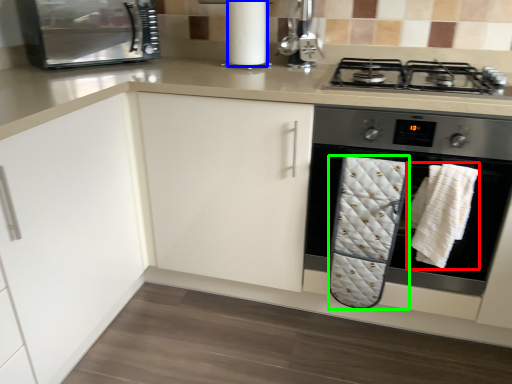
Question: Based on their relative distances, which object is farther from bath towel (highlighted by a red box)? Choose from paper towel (highlighted by a blue box) and bath towel (highlighted by a green box).

Choices:
 (A) paper towel
 (B) bath towel

Answer: (A)